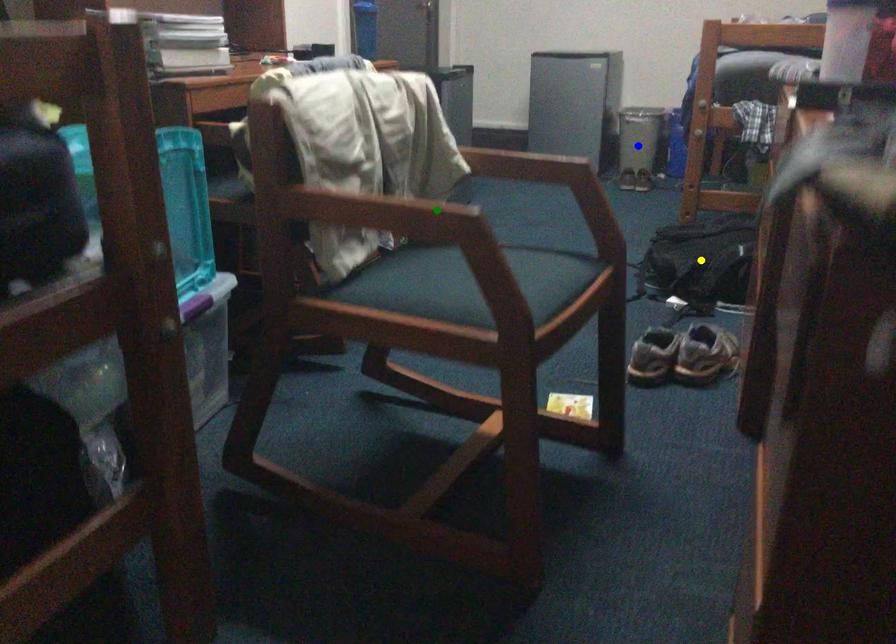
Order these from nearest to farthest:
green point, yellow point, blue point

green point < yellow point < blue point